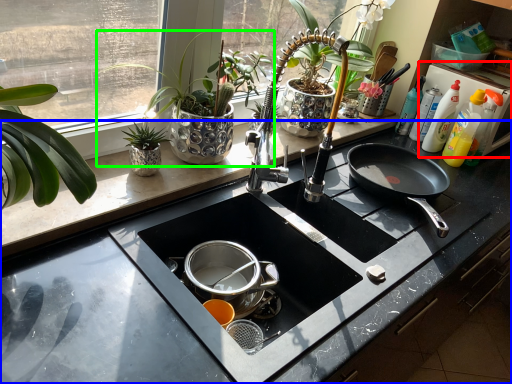
Question: Considering the real-world distances, which object is farthest from appliance (highlighted by a red box)? countertop (highlighted by a blue box) or houseplant (highlighted by a green box)?

Choices:
 (A) countertop
 (B) houseplant

Answer: (B)